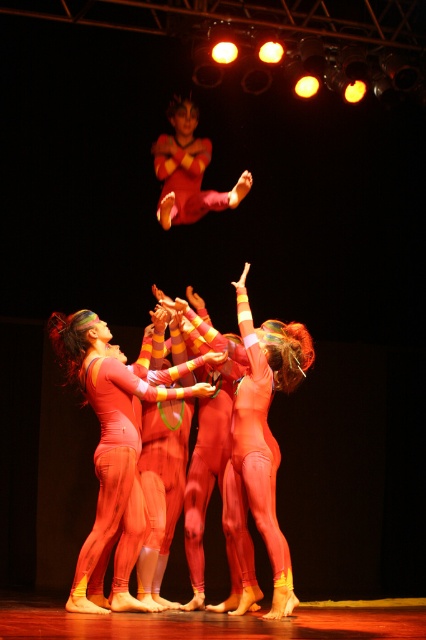
Is matte orange leotard at center above matte red leotard at upper center?

No, matte orange leotard at center is not above matte red leotard at upper center.

The height and width of the screenshot is (640, 426). I want to click on matte orange leotard at center, so click(x=112, y=451).

In order to click on matte orange leotard at center in this screenshot , I will do `click(112, 451)`.

Identify the location of matte orange leotard at center. This screenshot has height=640, width=426. (112, 451).